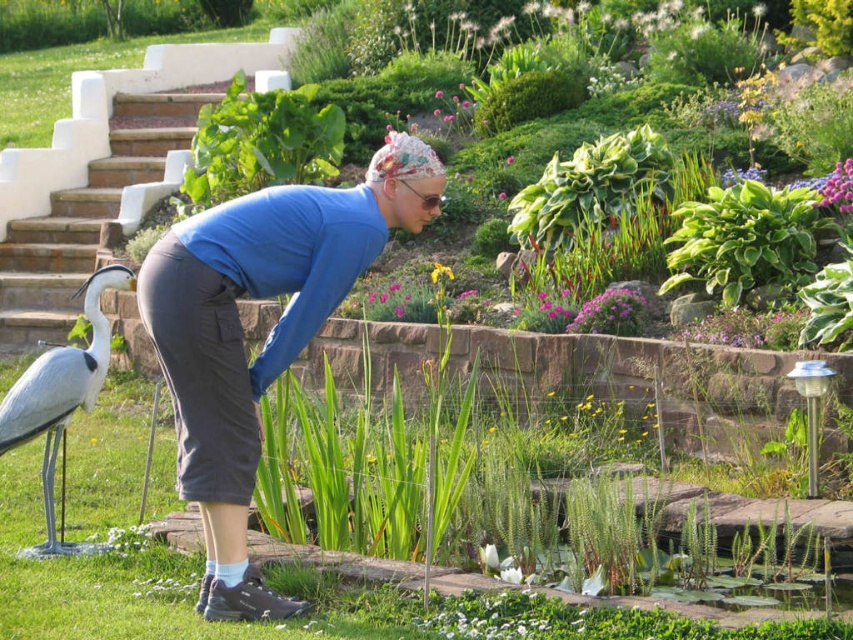
You are a gardener who needs to place a new decoration in the garden. You have a blue fabric at center and a white matte bird at lower left. Which object should you choose if you want to place a larger decoration?

The blue fabric at center is larger in size than the white matte bird at lower left, so you should choose the blue fabric at center for a larger decoration.

The person is standing in a garden with various plants and a water feature. You notice a point at coordinates (265, 337). What is located at this point?

The point at coordinates (265, 337) indicates the blue fabric at center.